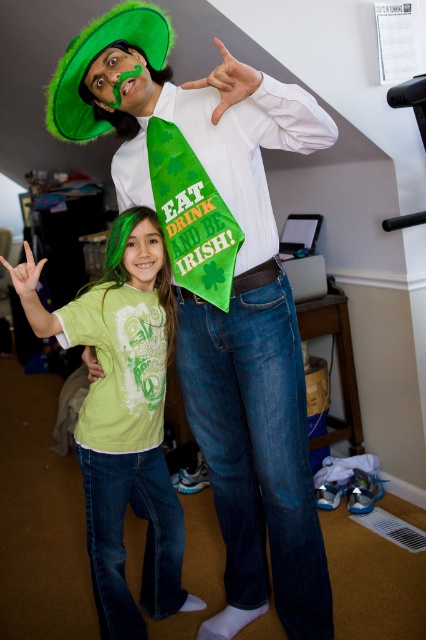
Question: Which object is positioned closest to the green felt hat at upper left?

Choices:
 (A) matte green face at center
 (B) green matte mustache at center
 (C) green fuzzy hat at upper left

Answer: (A)

Question: Which point is closer to the camera?

Choices:
 (A) green fuzzy hat at upper left
 (B) matte green face at center
 (C) green felt hat at upper left
 (D) green matte mustache at center

Answer: (C)

Question: Which object is the closest to the matte green face at center?

Choices:
 (A) green fuzzy hat at upper left
 (B) green matte mustache at center

Answer: (B)

Question: Can you confirm if green felt hat at upper left is positioned to the left of green matte shirt at center?

Choices:
 (A) no
 (B) yes

Answer: (A)

Question: Is green felt hat at upper left above green matte shirt at center?

Choices:
 (A) yes
 (B) no

Answer: (A)

Question: Can you confirm if green fuzzy hat at upper left is positioned below green matte mustache at center?

Choices:
 (A) no
 (B) yes

Answer: (A)